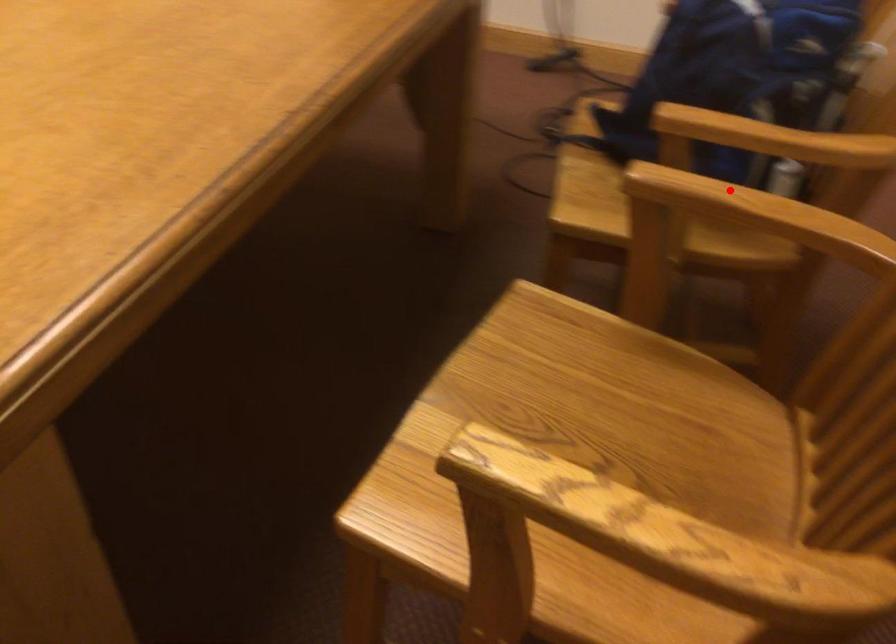
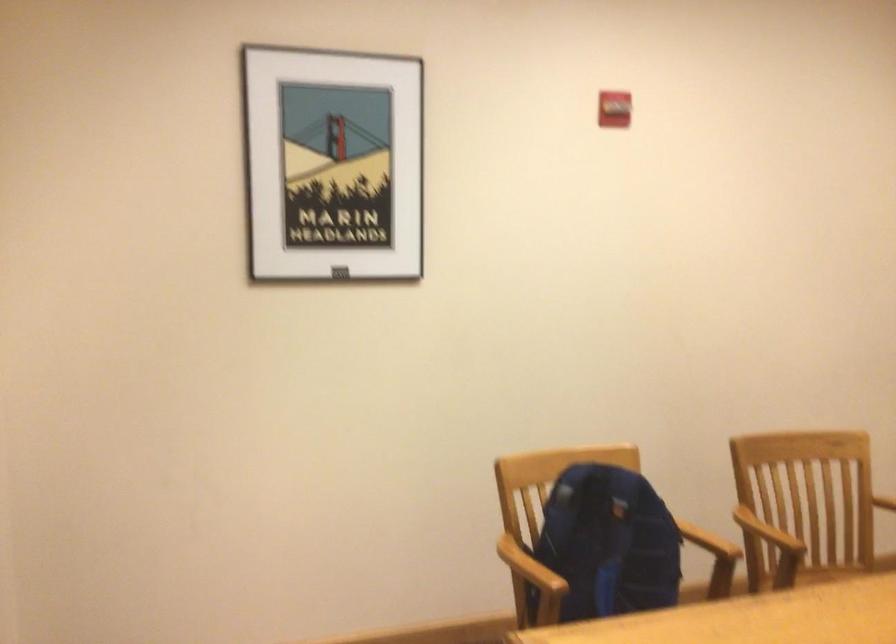
Question: I am providing you with two images of the same scene from different viewpoints. Image1 has a red point marked. In image2, the corresponding 3D location appears at what relative position? Reply with the corresponding letter.

Choices:
 (A) Closer
 (B) Farther

Answer: (B)